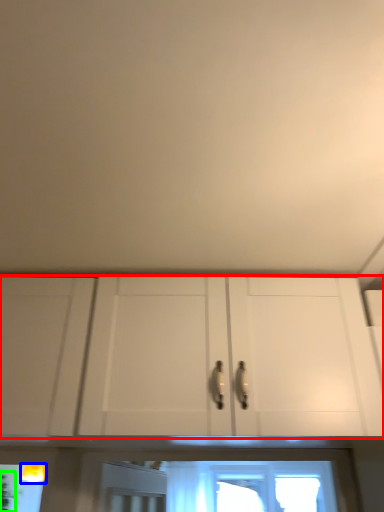
Question: Which is farther away from cabinetry (highlighted by a red box)? light fixture (highlighted by a blue box) or plant (highlighted by a green box)?

Choices:
 (A) light fixture
 (B) plant

Answer: (B)